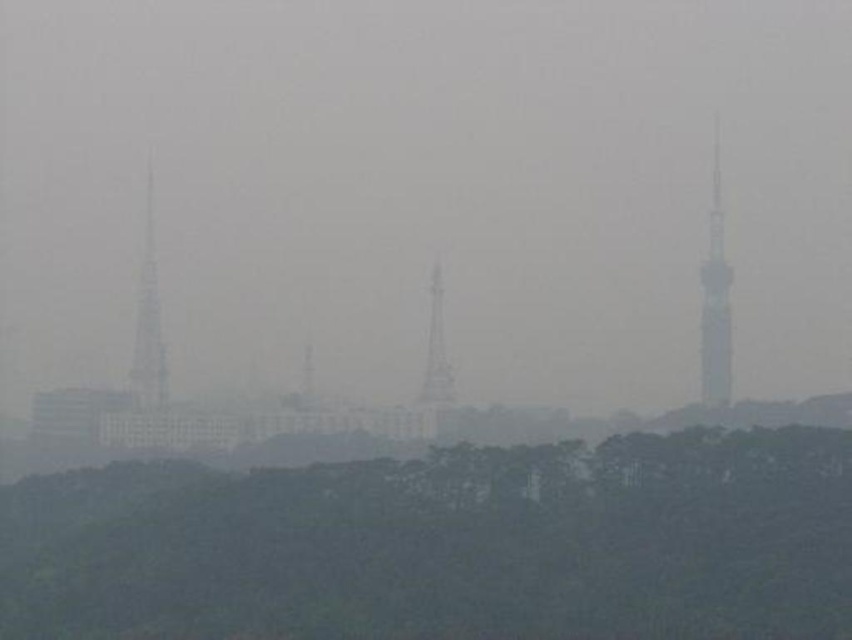
You are a city planner reviewing this urban landscape. You need to determine which of the two towers, the smokey metallic tower at left or the smokey gray tower at center, is the taller one based on the image provided. Which tower is taller?

The smokey metallic tower at left is taller than the smokey gray tower at center according to the description.

You are a drone operator trying to navigate between the metallic silver tower at right and the smokey metallic tower at left. Which tower should you fly over to stay on course?

The metallic silver tower at right is positioned over the smokey metallic tower at left, so you should fly over the metallic silver tower at right to stay on course.

You are a drone operator trying to navigate through the hazy urban landscape. You need to deliver a package to the metallic silver tower at right, but you must avoid flying through the dark green foliage at lower center. Can you fly directly from your current position to the tower without passing through the foliage?

The dark green foliage at lower center is in front of the metallic silver tower at right, so the foliage is blocking the direct path to the tower. You cannot fly directly to the tower without passing through the foliage.